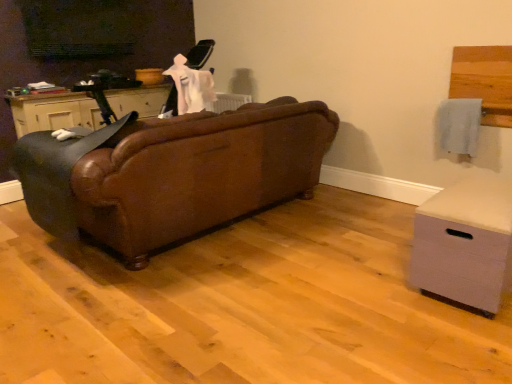
Question: Considering the positions of point (467, 233) and point (65, 200), is point (467, 233) closer or farther from the camera than point (65, 200)?

Choices:
 (A) farther
 (B) closer

Answer: (B)

Question: From the image's perspective, is light gray fabric chest of drawers at lower right located above or below brown leather rocking chair at left?

Choices:
 (A) below
 (B) above

Answer: (A)

Question: Considering the real-world distances, which object is closest to the light gray fabric chest of drawers at lower right?

Choices:
 (A) brown leather couch at center
 (B) brown leather rocking chair at left
 (C) matte black cabinet at left

Answer: (A)

Question: Which object is positioned closest to the brown leather rocking chair at left?

Choices:
 (A) brown leather couch at center
 (B) light gray fabric chest of drawers at lower right
 (C) matte black cabinet at left

Answer: (A)